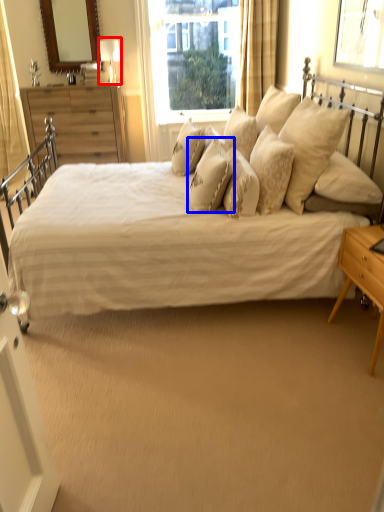
Question: Which object is further to the camera taking this photo, table lamp (highlighted by a red box) or pillow (highlighted by a blue box)?

Choices:
 (A) table lamp
 (B) pillow

Answer: (A)